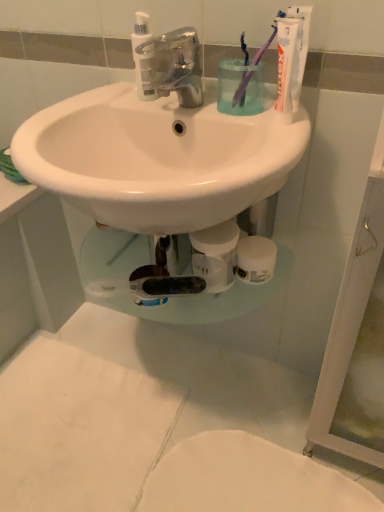
Question: In the image, is translucent plastic pump bottle at upper center on the left side or the right side of translucent plastic cup at upper center?

Choices:
 (A) right
 (B) left

Answer: (B)

Question: From their relative heights in the image, would you say translucent plastic pump bottle at upper center is taller or shorter than translucent plastic cup at upper center?

Choices:
 (A) tall
 (B) short

Answer: (A)

Question: Estimate the real-world distances between objects in this image. Which object is closer to the translucent plastic pump bottle at upper center?

Choices:
 (A) purple plastic toothbrush at upper right, which is counted as the 1th toothbrush, starting from the right
 (B) chrome metallic faucet at center
 (C) purple plastic toothbrush at upper center, which ranks as the first toothbrush in left-to-right order
 (D) white matte toilet at lower center
 (E) translucent plastic cup at upper center

Answer: (B)

Question: Which is nearer to the purple plastic toothbrush at upper center, arranged as the second toothbrush when viewed from the right?

Choices:
 (A) chrome metallic faucet at center
 (B) purple plastic toothbrush at upper right, which is counted as the 1th toothbrush, starting from the right
 (C) translucent plastic pump bottle at upper center
 (D) translucent plastic cup at upper center
 (E) white matte toilet at lower center

Answer: (B)